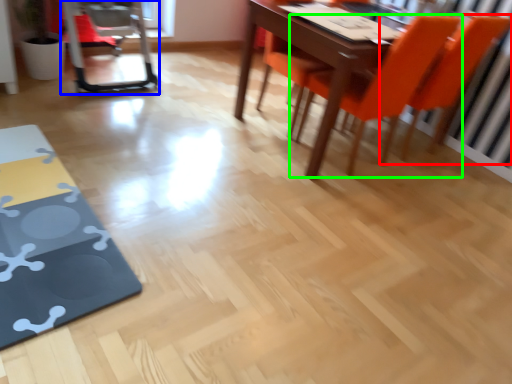
Question: Estimate the real-world distances between objects in this image. Which object is closer to chair (highlighted by a red box), swivel chair (highlighted by a blue box) or chair (highlighted by a green box)?

Choices:
 (A) swivel chair
 (B) chair

Answer: (B)